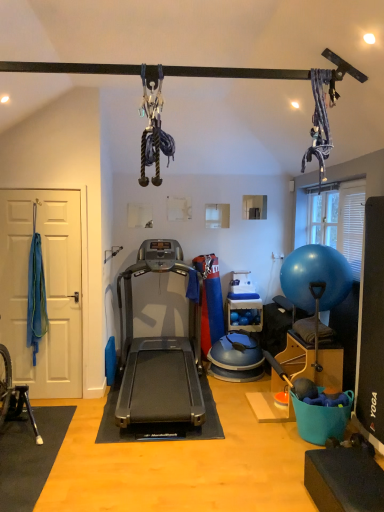
Question: Considering the relative sizes of silver metallic treadmill at center and blue rubber ball at right in the image provided, is silver metallic treadmill at center wider than blue rubber ball at right?

Choices:
 (A) no
 (B) yes

Answer: (B)

Question: From a real-world perspective, is silver metallic treadmill at center physically below blue rubber ball at right?

Choices:
 (A) yes
 (B) no

Answer: (A)

Question: Is silver metallic treadmill at center completely or partially outside of blue rubber ball at right?

Choices:
 (A) yes
 (B) no

Answer: (A)

Question: Can you confirm if silver metallic treadmill at center is positioned to the right of blue rubber ball at right?

Choices:
 (A) no
 (B) yes

Answer: (A)

Question: Does silver metallic treadmill at center come behind blue rubber ball at right?

Choices:
 (A) no
 (B) yes

Answer: (A)

Question: Considering the relative sizes of silver metallic treadmill at center and blue rubber ball at right in the image provided, is silver metallic treadmill at center taller than blue rubber ball at right?

Choices:
 (A) yes
 (B) no

Answer: (A)

Question: Is blue rubber ball at right in contact with silver metallic treadmill at center?

Choices:
 (A) no
 (B) yes

Answer: (A)

Question: Is blue rubber ball at right at the right side of silver metallic treadmill at center?

Choices:
 (A) no
 (B) yes

Answer: (B)

Question: Does blue rubber ball at right have a greater width compared to silver metallic treadmill at center?

Choices:
 (A) yes
 (B) no

Answer: (B)

Question: Can you confirm if blue rubber ball at right is bigger than silver metallic treadmill at center?

Choices:
 (A) no
 (B) yes

Answer: (A)

Question: Is silver metallic treadmill at center surrounded by blue rubber ball at right?

Choices:
 (A) yes
 (B) no

Answer: (B)

Question: Considering the relative sizes of blue rubber ball at right and silver metallic treadmill at center in the image provided, is blue rubber ball at right smaller than silver metallic treadmill at center?

Choices:
 (A) no
 (B) yes

Answer: (B)

Question: Is blue rubber ball at right in front of or behind silver metallic treadmill at center in the image?

Choices:
 (A) behind
 (B) front

Answer: (A)